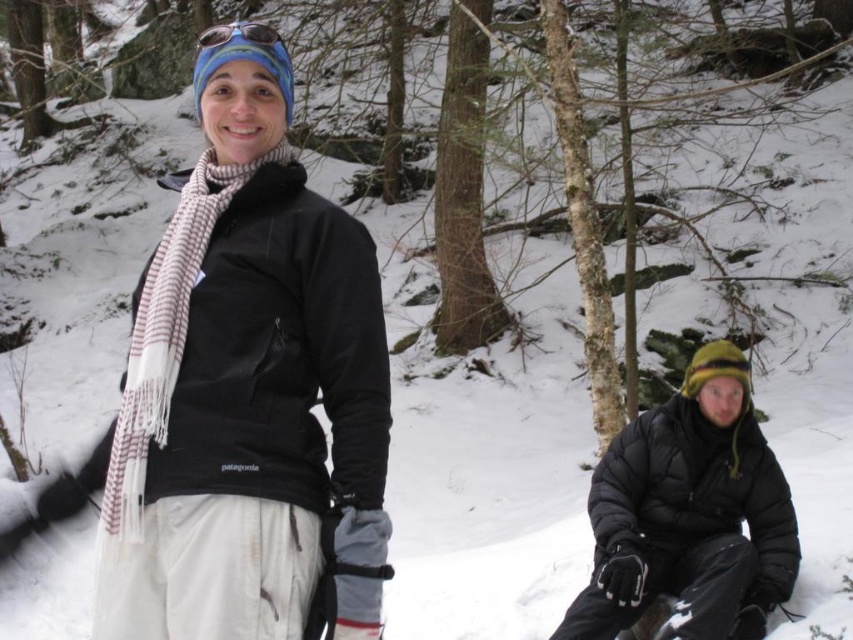
Looking at this image, you are trying to decide whether to pack the white striped scarf at center or the matte black goggles at upper center in your luggage. If you have a small bag that can only fit one item, which item would take up more space based on their width?

The white striped scarf at center might be wider than matte black goggles at upper center, so it would take up more space in the luggage.

You are planning to take a winter hike and need to decide which item to carry first between the black puffy jacket at lower right and the white striped scarf at center. Based on their sizes, which one should you pick up first?

The black puffy jacket at lower right is bigger than the white striped scarf at center, so you should pick up the black puffy jacket at lower right first because it requires more space and attention due to its larger size.